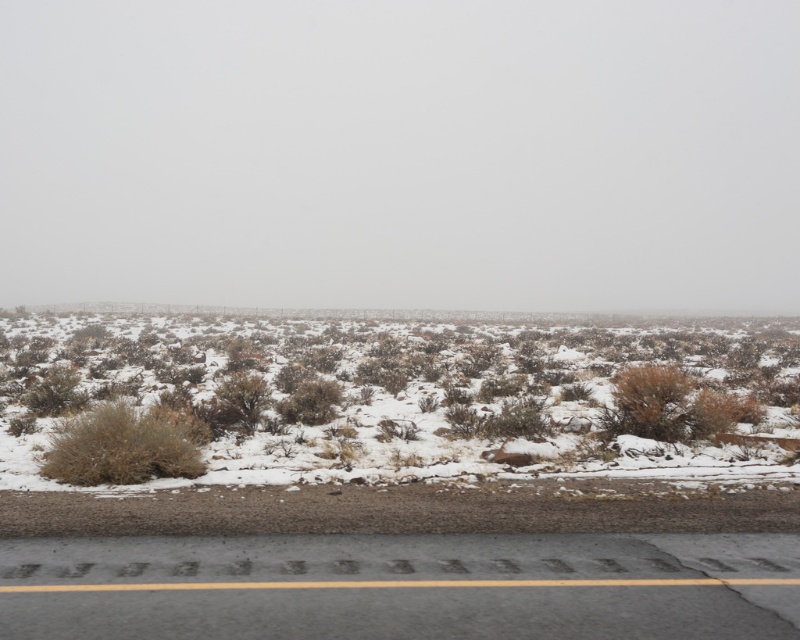
Is fuzzy brown shrubs at lower center to the left of dry shrub at center-left from the viewer's perspective?

Incorrect, fuzzy brown shrubs at lower center is not on the left side of dry shrub at center-left.

Between point (298, 445) and point (84, 476), which one is positioned behind?

The point (298, 445) is behind.

Locate an element on the screen. This screenshot has width=800, height=640. fuzzy brown shrubs at lower center is located at coordinates (384, 400).